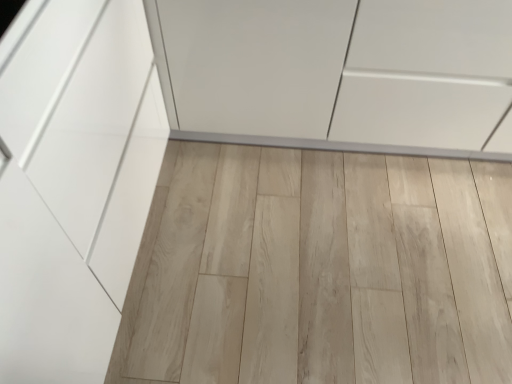
Find the location of `white glossy cabinet at center`. white glossy cabinet at center is located at coordinates (338, 73).

Measure the distance between white glossy cabinet at center and camera.

1.11 meters.

Describe the element at coordinates (338, 73) in the screenshot. I see `white glossy cabinet at center` at that location.

The width and height of the screenshot is (512, 384). What do you see at coordinates (320, 270) in the screenshot?
I see `natural wood plank at center` at bounding box center [320, 270].

Locate an element on the screen. This screenshot has width=512, height=384. natural wood plank at center is located at coordinates (320, 270).

The image size is (512, 384). I want to click on white glossy cabinet at center, so click(x=338, y=73).

Visually, is white glossy cabinet at center positioned to the left or to the right of natural wood plank at center?

white glossy cabinet at center is positioned on natural wood plank at center's right side.

Is white glossy cabinet at center closer to the viewer compared to natural wood plank at center?

Yes, white glossy cabinet at center is in front of natural wood plank at center.

Does point (309, 78) lie behind point (209, 256)?

No, it is not.

From the image's perspective, which object appears higher, white glossy cabinet at center or natural wood plank at center?

From the image's view, white glossy cabinet at center is above.

From a real-world perspective, is white glossy cabinet at center physically above natural wood plank at center?

Indeed, from a real-world perspective, white glossy cabinet at center stands above natural wood plank at center.

Based on the photo, in terms of width, does white glossy cabinet at center look wider or thinner when compared to natural wood plank at center?

In the image, white glossy cabinet at center appears to be more narrow than natural wood plank at center.

Is white glossy cabinet at center taller than natural wood plank at center?

Yes.

In terms of size, does white glossy cabinet at center appear bigger or smaller than natural wood plank at center?

In the image, white glossy cabinet at center appears to be larger than natural wood plank at center.

Would you say white glossy cabinet at center is inside or outside natural wood plank at center?

white glossy cabinet at center is spatially situated outside natural wood plank at center.

Is white glossy cabinet at center placed right next to natural wood plank at center?

No, white glossy cabinet at center is not beside natural wood plank at center.

Is white glossy cabinet at center oriented away from natural wood plank at center?

white glossy cabinet at center is not turned away from natural wood plank at center.

How many degrees apart are the facing directions of white glossy cabinet at center and natural wood plank at center?

white glossy cabinet at center and natural wood plank at center are facing 0.0321 degrees away from each other.

How much distance is there between white glossy cabinet at center and natural wood plank at center?

16.67 inches.

What are the coordinates of `cabinetry that is above the natural wood plank at center (from a real-world perspective)` in the screenshot? It's located at (338, 73).

Which is more to the right, natural wood plank at center or white glossy cabinet at center?

white glossy cabinet at center is more to the right.

Is natural wood plank at center behind white glossy cabinet at center?

Yes, natural wood plank at center is behind white glossy cabinet at center.

Is point (389, 361) in front of point (208, 120)?

Yes, point (389, 361) is closer to viewer.

From the image's perspective, does natural wood plank at center appear lower than white glossy cabinet at center?

Yes, from the image's perspective, natural wood plank at center is below white glossy cabinet at center.

From a real-world perspective, which object rests below the other?

natural wood plank at center is physically lower.

In terms of width, does natural wood plank at center look wider or thinner when compared to white glossy cabinet at center?

natural wood plank at center is wider than white glossy cabinet at center.

Considering the sizes of natural wood plank at center and white glossy cabinet at center in the image, is natural wood plank at center taller or shorter than white glossy cabinet at center?

Considering their sizes, natural wood plank at center has less height than white glossy cabinet at center.

Consider the image. Considering the sizes of objects natural wood plank at center and white glossy cabinet at center in the image provided, who is bigger, natural wood plank at center or white glossy cabinet at center?

white glossy cabinet at center.

Is natural wood plank at center positioned beyond the bounds of white glossy cabinet at center?

Yes, natural wood plank at center is located beyond the bounds of white glossy cabinet at center.

Is natural wood plank at center far away from white glossy cabinet at center?

They are positioned close to each other.

Is natural wood plank at center oriented away from white glossy cabinet at center?

No, white glossy cabinet at center is not at the back of natural wood plank at center.

You are a GUI agent. You are given a task and a screenshot of the screen. Output one action in this format:
    pyautogui.click(x=<x>, y=<y>)
    Task: Click on the cabinetry above the natural wood plank at center (from the image's perspective)
    This screenshot has height=384, width=512.
    Given the screenshot: What is the action you would take?
    pyautogui.click(x=338, y=73)

Locate an element on the screen. The image size is (512, 384). plank below the white glossy cabinet at center (from a real-world perspective) is located at coordinates (320, 270).

Where is `cabinetry that is above the natural wood plank at center (from the image's perspective)`? cabinetry that is above the natural wood plank at center (from the image's perspective) is located at coordinates (338, 73).